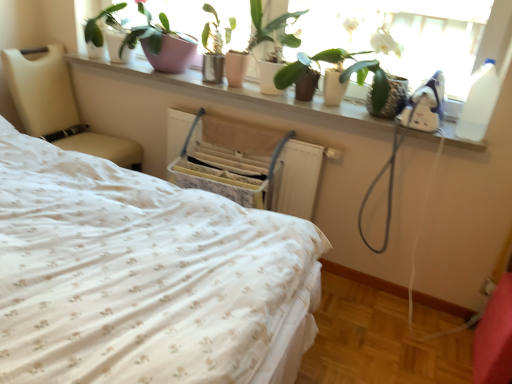
Question: From the image's perspective, is wooden swivel chair at center located above or below green matte plant at upper center, arranged as the 1th houseplant when viewed from the right?

Choices:
 (A) above
 (B) below

Answer: (B)

Question: Considering their positions, is wooden swivel chair at center located in front of or behind green matte plant at upper center, arranged as the 1th houseplant when viewed from the right?

Choices:
 (A) front
 (B) behind

Answer: (A)

Question: Estimate the real-world distances between objects in this image. Which object is closer to the wooden swivel chair at center?

Choices:
 (A) white ceramic plants at upper center
 (B) matte white pot at upper center
 (C) white floral fabric bed at center
 (D) beige leather chair at left
 (E) pink ceramic pot at upper center, acting as the second houseplant starting from the right

Answer: (A)

Question: Which is farther from the matte white pot at upper center?

Choices:
 (A) green matte plant at upper center, arranged as the 1th houseplant when viewed from the right
 (B) wooden swivel chair at center
 (C) white floral fabric bed at center
 (D) pink ceramic pot at upper center, which is counted as the first houseplant, starting from the left
 (E) beige leather chair at left

Answer: (C)